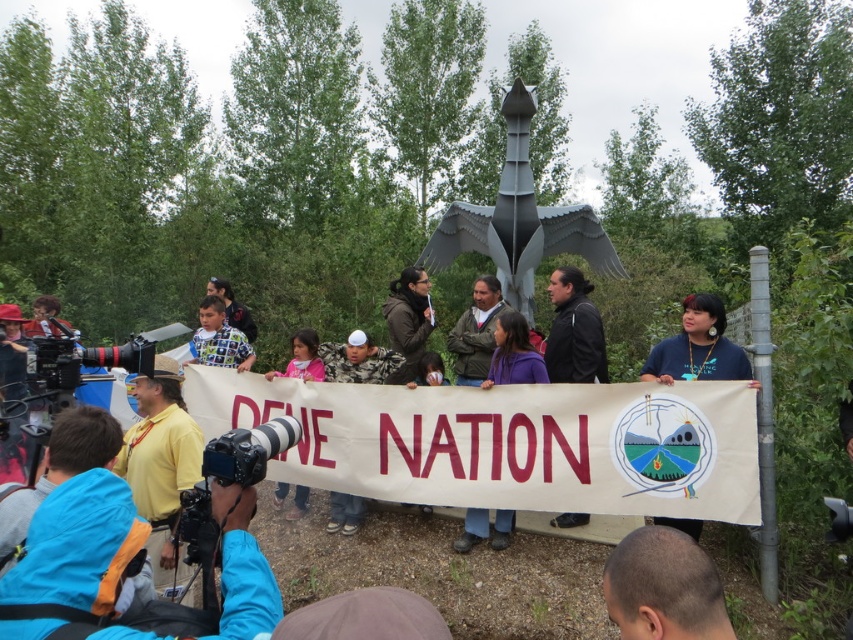
You are a photographer trying to capture both the black leather jacket at center and the camouflage fabric shirt at center in the same frame. Since you want to ensure both are clearly visible, which clothing item should you focus on first to avoid blurring due to their sizes?

The black leather jacket at center is thinner than the camouflage fabric shirt at center, so you should focus on the camouflage fabric shirt at center first as it is larger and might require more precise focusing to ensure clarity.

You are a photographer taking a picture of the metal bird sculpture. You notice two points marked on your camera screen at coordinates point (167, 492) and point (589, 516). Which point is closer to your camera lens?

Point (167, 492) is closer to the camera than point (589, 516).

You are a photographer trying to capture the group holding the banner. You notice two shirts at the center of the image, a yellow shirt at center and a pink fabric shirt at center. Which shirt should you focus on to ensure the person wearing it is standing in front of the metal bird sculpture?

The yellow shirt at center is below the pink fabric shirt at center, so the person wearing the pink fabric shirt at center is standing in front of the metal bird sculpture.